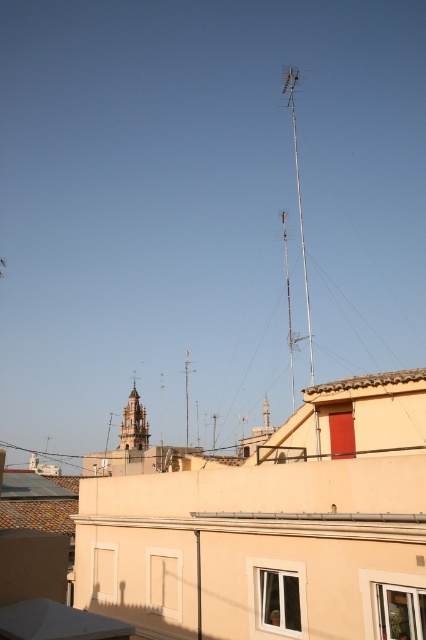
Question: Can you confirm if metallic antenna at upper center is positioned below golden stone tower at center?

Choices:
 (A) yes
 (B) no

Answer: (B)

Question: Which point appears farthest from the camera in this image?

Choices:
 (A) (301, 243)
 (B) (132, 396)

Answer: (A)

Question: Is metallic antenna at upper center below golden stone tower at center?

Choices:
 (A) yes
 (B) no

Answer: (B)

Question: Which object is closer to the camera taking this photo?

Choices:
 (A) golden stone tower at center
 (B) metallic antenna at upper center

Answer: (A)

Question: Which of the following is the closest to the observer?

Choices:
 (A) (293, 145)
 (B) (137, 440)

Answer: (B)

Question: Can you confirm if metallic antenna at upper center is bigger than golden stone tower at center?

Choices:
 (A) yes
 (B) no

Answer: (A)